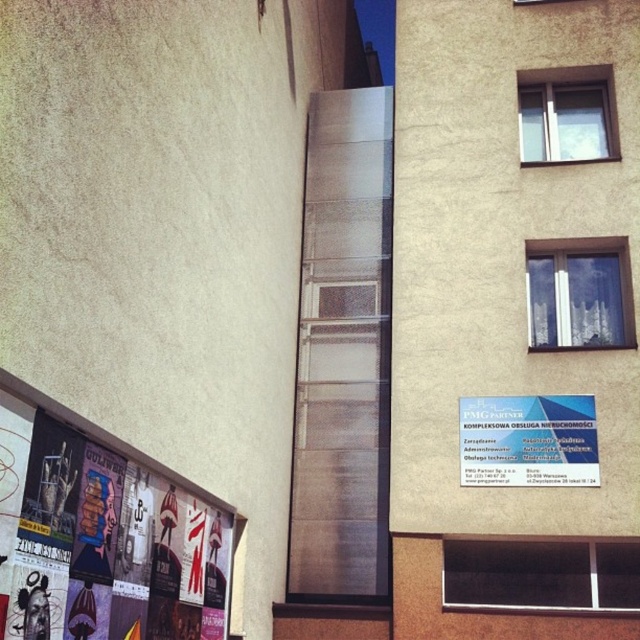
Is transparent glass window at center thinner than clear glass window at upper right?

In fact, transparent glass window at center might be wider than clear glass window at upper right.

Does transparent glass window at center have a greater height compared to clear glass window at upper right?

No.

Who is more distant from viewer, (x=477, y=563) or (x=611, y=100)?

Point (x=611, y=100)

The width and height of the screenshot is (640, 640). I want to click on transparent glass window at center, so click(540, 573).

Who is more forward, (460, 412) or (547, 128)?

Point (460, 412) is more forward.

Is white plastic sign at center right taller than clear glass window at upper right?

In fact, white plastic sign at center right may be shorter than clear glass window at upper right.

Image resolution: width=640 pixels, height=640 pixels. I want to click on white plastic sign at center right, so click(x=529, y=442).

Can you confirm if white plastic sign at center right is bigger than white sheer curtain at upper right?

Actually, white plastic sign at center right might be smaller than white sheer curtain at upper right.

Which is behind, point (588, 410) or point (616, 333)?

Point (616, 333)

Does point (509, 416) come in front of point (586, 289)?

Yes, it is.

Locate an element on the screen. This screenshot has height=640, width=640. white plastic sign at center right is located at coordinates (529, 442).